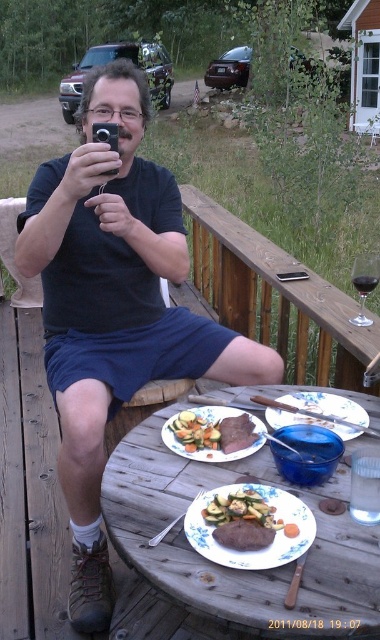
You are standing on the wooden deck and want to place a small potted plant between the two points marked as point (188, 529) and point (237, 452). According to the scene, which point should the plant be closer to?

The plant should be placed closer to point (188, 529) because it is in front of point (237, 452).

You are a waiter at this outdoor dining deck. You need to place a 30 cm long platter between the white matte plate at center and the white ceramic plate at center. Will there be enough space?

The distance between the white matte plate at center and white ceramic plate at center is 32.51 centimeters. Since the platter is 30 cm long, there is enough space to place it between them.